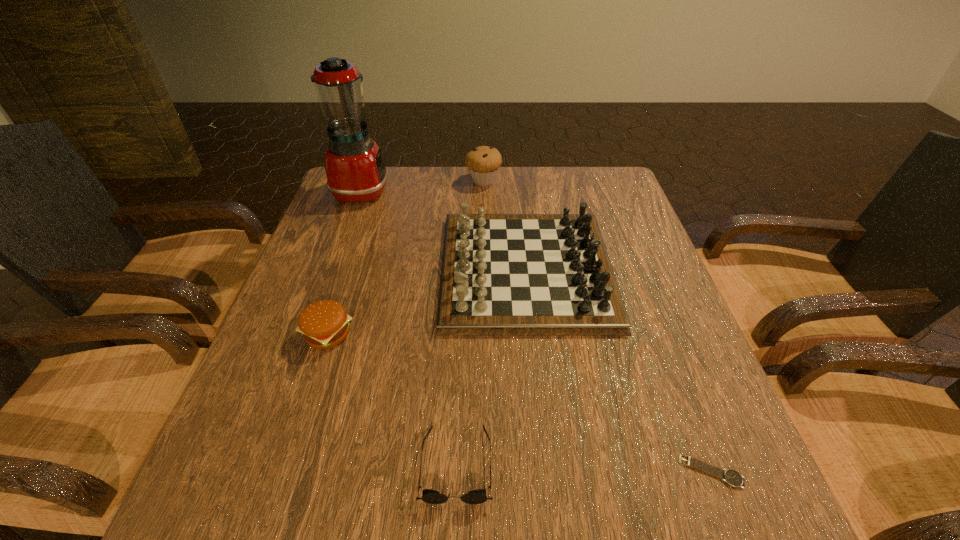
Locate an element on the screen. Image resolution: width=960 pixels, height=540 pixels. chessboard that is positioned at the right edge is located at coordinates (502, 274).

I want to click on watch situated at the right edge, so click(730, 476).

Where is `object at the far left corner`? The width and height of the screenshot is (960, 540). object at the far left corner is located at coordinates (355, 170).

Image resolution: width=960 pixels, height=540 pixels. I want to click on object that is positioned at the near right corner, so click(x=730, y=476).

In the image, there is a desktop. Where is `vacant space at the far edge`? The image size is (960, 540). vacant space at the far edge is located at coordinates (544, 209).

In the image, there is a desktop. Where is `vacant area at the near edge`? vacant area at the near edge is located at coordinates (413, 518).

You are a GUI agent. You are given a task and a screenshot of the screen. Output one action in this format:
    pyautogui.click(x=<x>, y=<y>)
    Task: Click on the vacant region at the left edge
    The height and width of the screenshot is (540, 960).
    Given the screenshot: What is the action you would take?
    pyautogui.click(x=316, y=251)

The width and height of the screenshot is (960, 540). In the image, there is a desktop. In order to click on free region at the right edge in this screenshot , I will do `click(613, 211)`.

This screenshot has width=960, height=540. What are the coordinates of `free space that is in between the shortest object and the third shortest object` in the screenshot? It's located at (519, 403).

At what (x,y) coordinates should I click in order to perform the action: click on vacant region between the third shortest object and the watch. Please return your answer as a coordinate pair (x, y). Looking at the image, I should click on (519, 403).